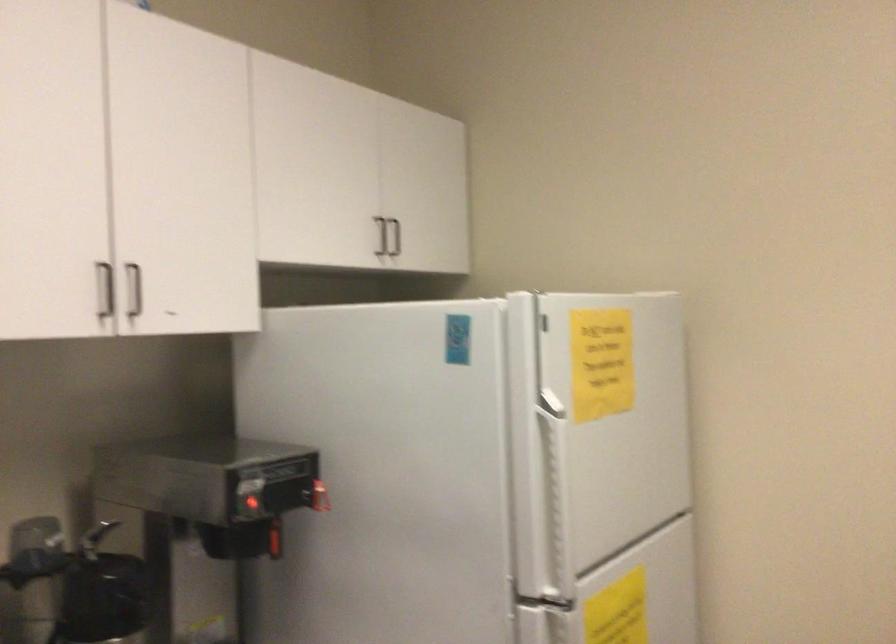
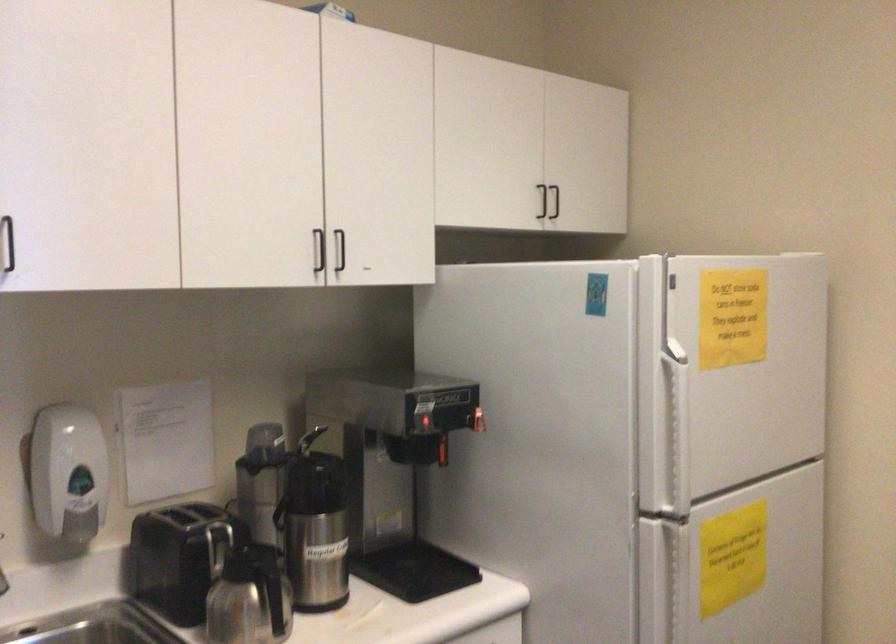
Find the pixel in the second image that matches pixel 112 285 in the first image.

(319, 250)